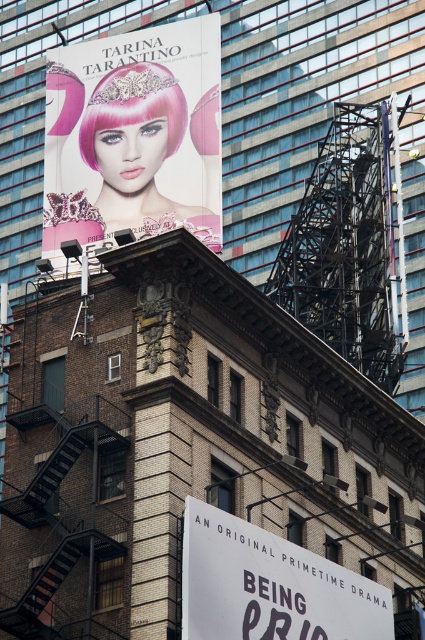
Question: Which point is farther from the camera taking this photo?

Choices:
 (A) (78, 547)
 (B) (135, 36)
 (C) (93, 115)

Answer: (B)

Question: Where is white paper sign at lower center located in relation to pink matte wig at upper left in the image?

Choices:
 (A) below
 (B) above

Answer: (A)

Question: Which object appears farthest from the camera in this image?

Choices:
 (A) white paper sign at lower center
 (B) black metal fire escape at lower left

Answer: (B)

Question: Which object is closer to the camera taking this photo?

Choices:
 (A) matte pink wig at upper left
 (B) pink matte wig at upper left
 (C) white paper sign at lower center

Answer: (C)

Question: Is matte pink wig at upper left further to camera compared to black metal fire escape at lower left?

Choices:
 (A) no
 (B) yes

Answer: (B)

Question: Can you confirm if black metal fire escape at lower left is thinner than pink matte wig at upper left?

Choices:
 (A) no
 (B) yes

Answer: (B)